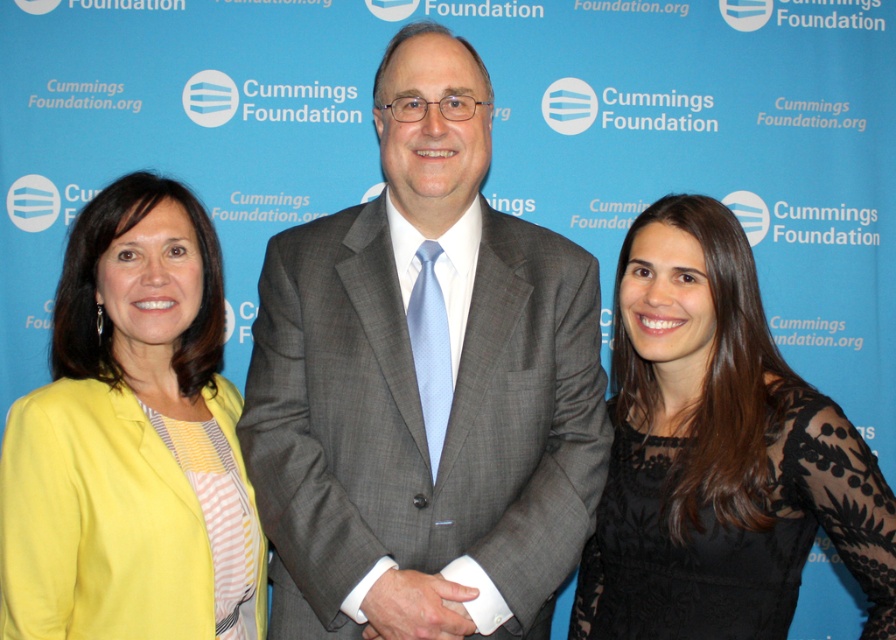
Is point (892, 502) in front of point (106, 445)?

No.

Is black lace dress at center smaller than yellow fabric jacket at left?

No, black lace dress at center is not smaller than yellow fabric jacket at left.

Who is more distant from viewer, (747, 320) or (78, 592)?

Positioned behind is point (747, 320).

The width and height of the screenshot is (896, 640). I want to click on black lace dress at center, so click(x=718, y=452).

Locate an element on the screen. Image resolution: width=896 pixels, height=640 pixels. gray suit at center is located at coordinates (425, 376).

What do you see at coordinates (425, 376) in the screenshot? I see `gray suit at center` at bounding box center [425, 376].

Is point (524, 448) positioned after point (184, 353)?

No, (524, 448) is in front of (184, 353).

Where is `gray suit at center`? gray suit at center is located at coordinates (425, 376).

Between yellow fabric jacket at left and white smooth shirt at center, which one has less height?

With less height is white smooth shirt at center.

The height and width of the screenshot is (640, 896). Describe the element at coordinates (119, 429) in the screenshot. I see `yellow fabric jacket at left` at that location.

This screenshot has height=640, width=896. What are the coordinates of `yellow fabric jacket at left` in the screenshot? It's located at (119, 429).